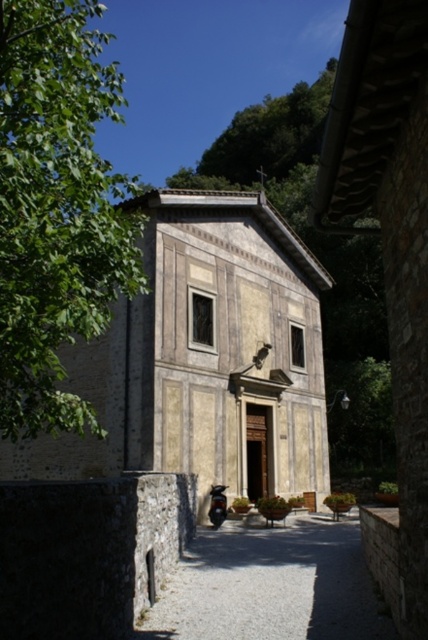
Question: Is yellowish stone chapel at center above green leafy tree at upper left?

Choices:
 (A) no
 (B) yes

Answer: (A)

Question: Does yellowish stone chapel at center lie behind green leafy tree at upper left?

Choices:
 (A) yes
 (B) no

Answer: (A)

Question: Does yellowish stone chapel at center have a larger size compared to green leafy tree at upper left?

Choices:
 (A) no
 (B) yes

Answer: (A)

Question: Which point is closer to the camera?

Choices:
 (A) green leafy tree at upper left
 (B) yellowish stone chapel at center

Answer: (A)